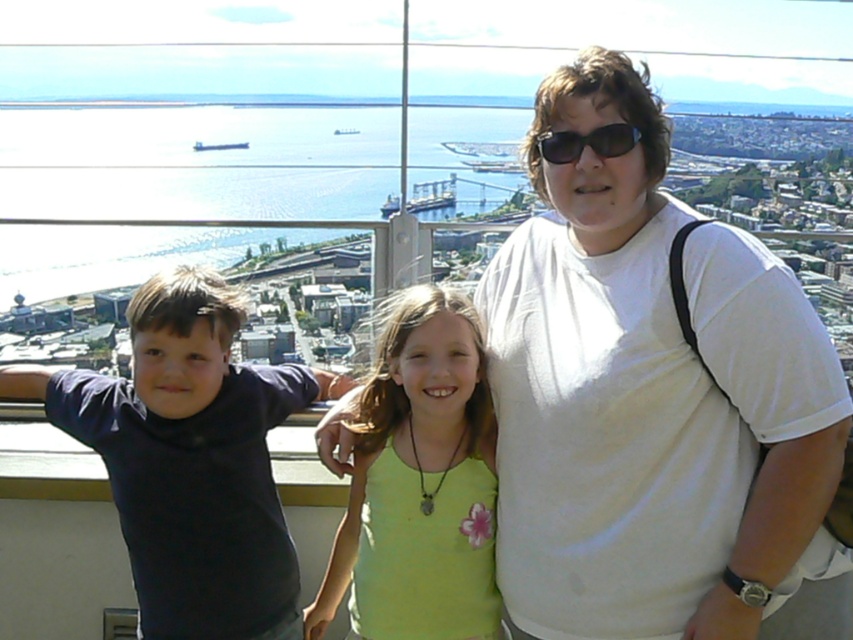
Does white cotton shirt at center appear under black plastic sunglasses at upper center?

Correct, white cotton shirt at center is located below black plastic sunglasses at upper center.

Which is in front, point (676, 545) or point (624, 125)?

Point (676, 545) is in front.

What do you see at coordinates (651, 401) in the screenshot? I see `white cotton shirt at center` at bounding box center [651, 401].

Where is `white cotton shirt at center`? The image size is (853, 640). white cotton shirt at center is located at coordinates (651, 401).

Does green fabric shirt at center appear on the left side of black plastic sunglasses at upper center?

Indeed, green fabric shirt at center is positioned on the left side of black plastic sunglasses at upper center.

Is green fabric shirt at center below black plastic sunglasses at upper center?

Indeed, green fabric shirt at center is positioned under black plastic sunglasses at upper center.

What do you see at coordinates (419, 484) in the screenshot?
I see `green fabric shirt at center` at bounding box center [419, 484].

What are the coordinates of `green fabric shirt at center` in the screenshot? It's located at pyautogui.click(x=419, y=484).

Who is shorter, white cotton shirt at center or dark blue shirt at left?

dark blue shirt at left

The image size is (853, 640). What do you see at coordinates (651, 401) in the screenshot? I see `white cotton shirt at center` at bounding box center [651, 401].

Who is more distant from viewer, (590, 220) or (157, 611)?

The point (157, 611) is behind.

Identify the location of white cotton shirt at center. Image resolution: width=853 pixels, height=640 pixels. (651, 401).